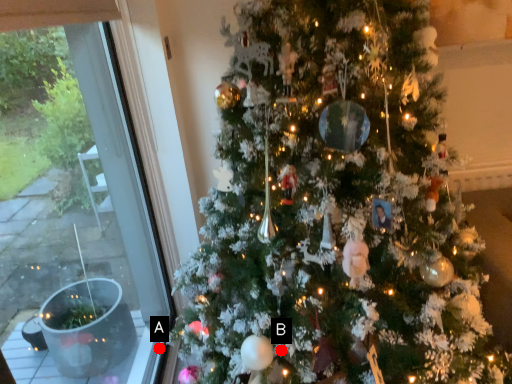
Question: Two points are circled on the image, labeled by A and B beside each circle. Which of the following is the closest to the observer?

Choices:
 (A) A is closer
 (B) B is closer

Answer: (B)